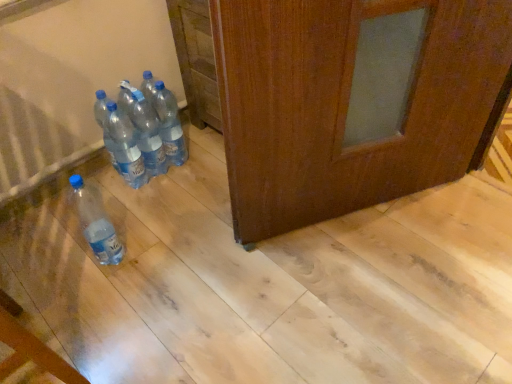
Find the location of a particular element. The image size is (512, 384). free space in front of matte plastic bottle at lower left, which appears as the fourth bottle when viewed from the right is located at coordinates pos(100,302).